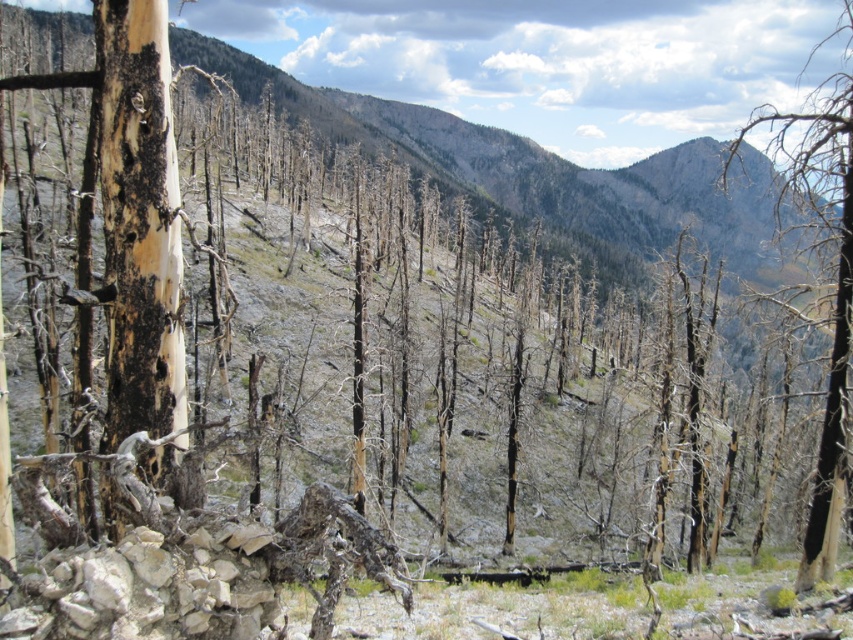
Question: Is charcoal textured tree trunk at left smaller than charred wood tree at right?

Choices:
 (A) yes
 (B) no

Answer: (A)

Question: Among these objects, which one is farthest from the camera?

Choices:
 (A) charred wood tree at right
 (B) charcoal textured tree trunk at left

Answer: (A)

Question: Where is charcoal textured tree trunk at left located in relation to charred wood tree at right in the image?

Choices:
 (A) left
 (B) right

Answer: (A)

Question: Is charcoal textured tree trunk at left thinner than charred wood tree at right?

Choices:
 (A) yes
 (B) no

Answer: (A)